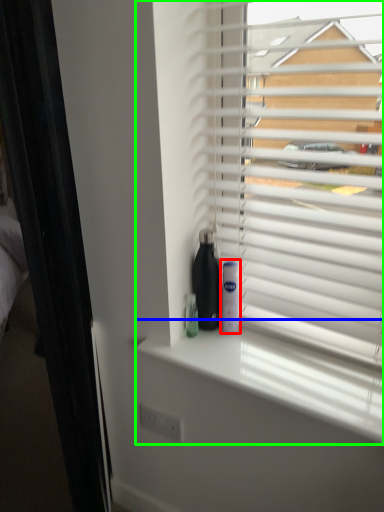
Question: Considering the real-world distances, which object is closest to mouthwash (highlighted by a red box)? window sill (highlighted by a blue box) or window blind (highlighted by a green box).

Choices:
 (A) window sill
 (B) window blind

Answer: (A)